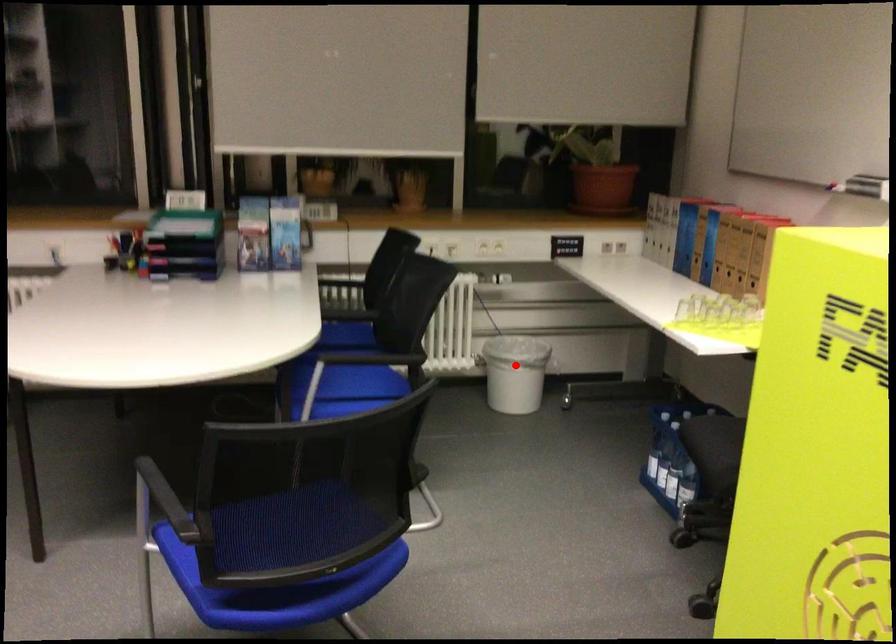
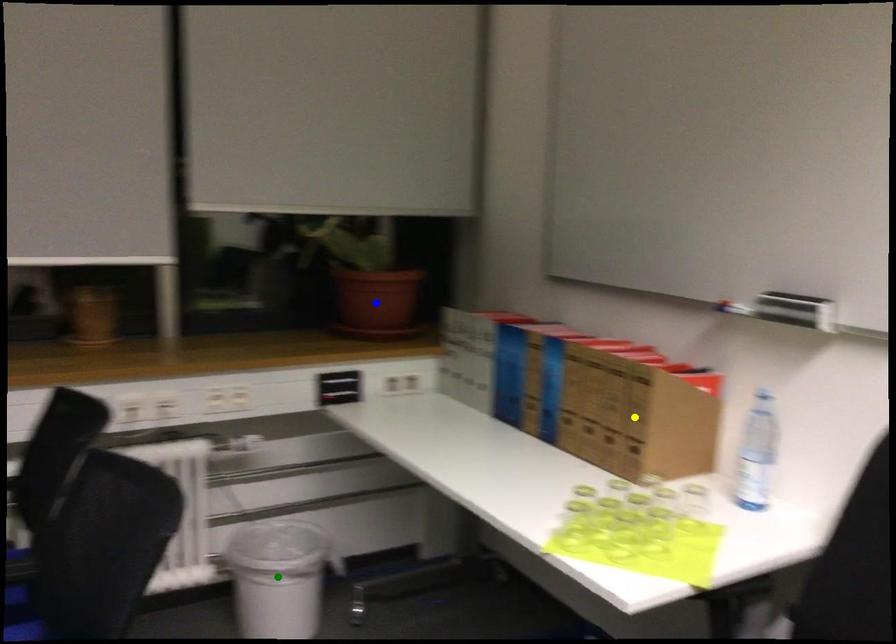
Question: I am providing you with two images of the same scene from different viewpoints. A red point is marked on the first image. You are given multiple points on the second image. Which point in image 2 represents the same 3d spot as the red point in image 1?

Choices:
 (A) yellow point
 (B) green point
 (C) blue point

Answer: (B)